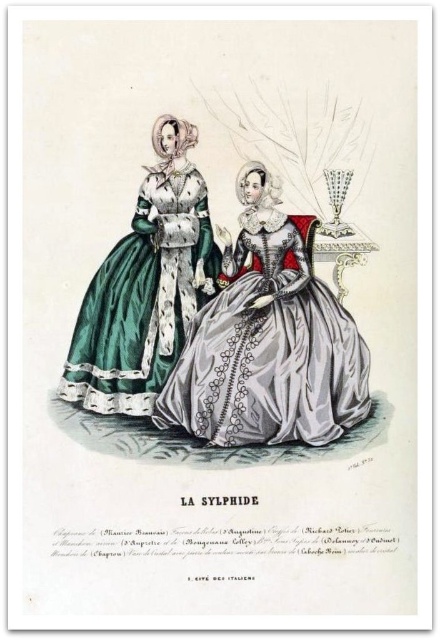
In the vintage illustration labeled LA SYLPHIDE, there are two women wearing a silvery satin gown at center and a green satin dress at left. Based on their positions, which one is standing closer to the right side of the image?

The silvery satin gown at center is to the right of the green satin dress at left, so the silvery satin gown at center is closer to the right side of the image.

You are an art conservator examining the vintage illustration of two women labeled LA SYLPHIDE. You notice two points marked in the image at coordinates point (366, 413) and point (114, 284). Which of these points is positioned closer to the viewer?

Answer: Point (366, 413) is closer to the viewer than point (114, 284) according to the provided description.

Based on the photo, based on the scene description, where is the silvery satin gown at center located in terms of its 2D coordinates?

The silvery satin gown at center is located at the 2D coordinates point (267, 339).